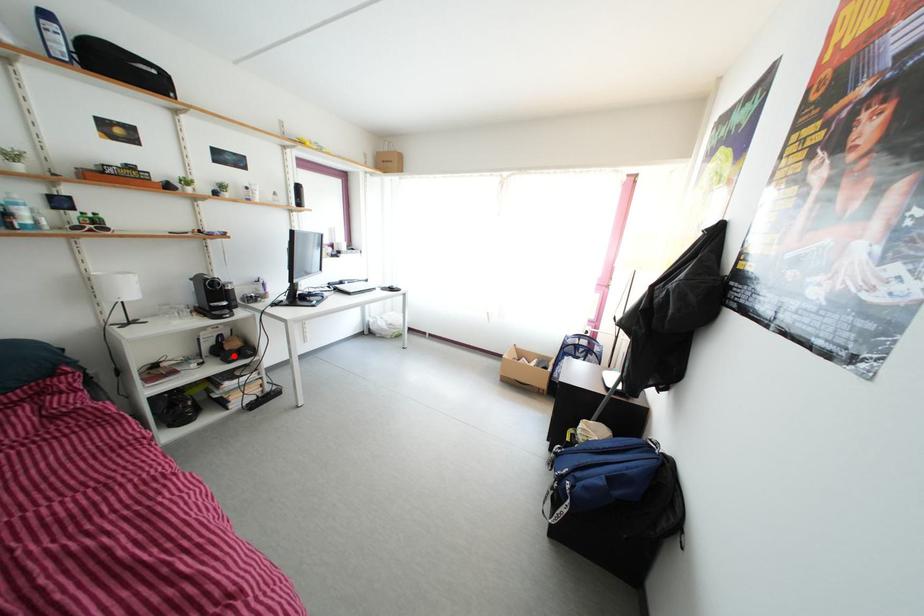
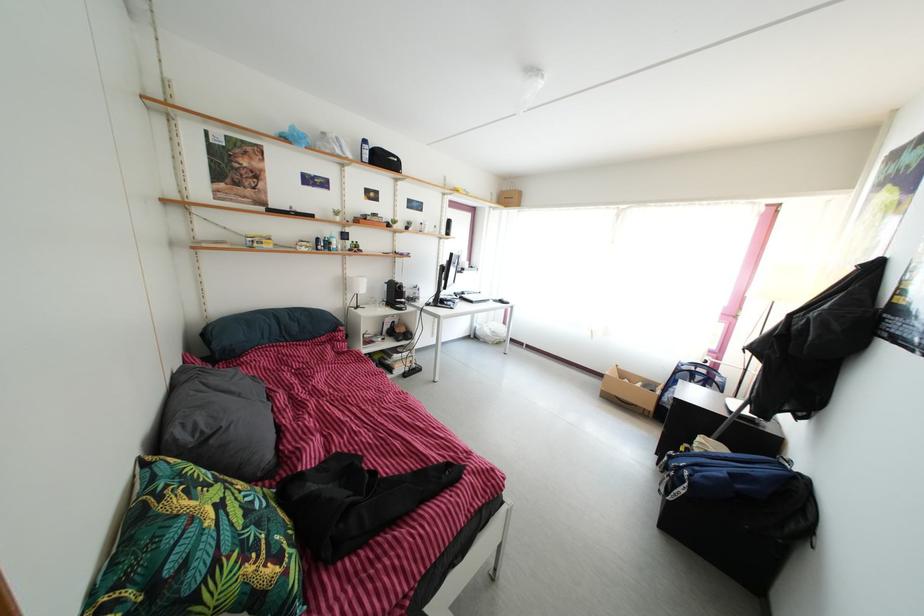
Find the pixel in the second image that matches the highlighted location in the first image.

(405, 339)